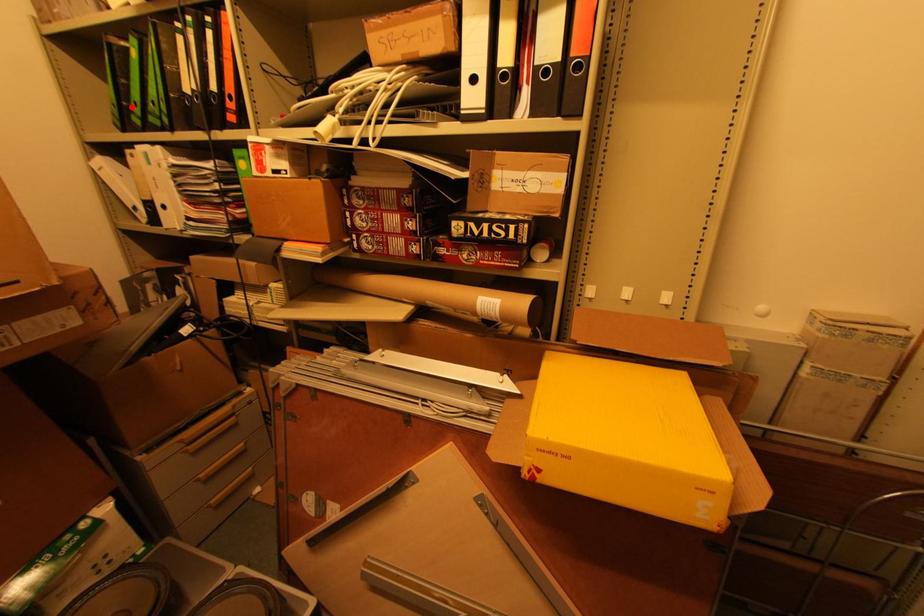
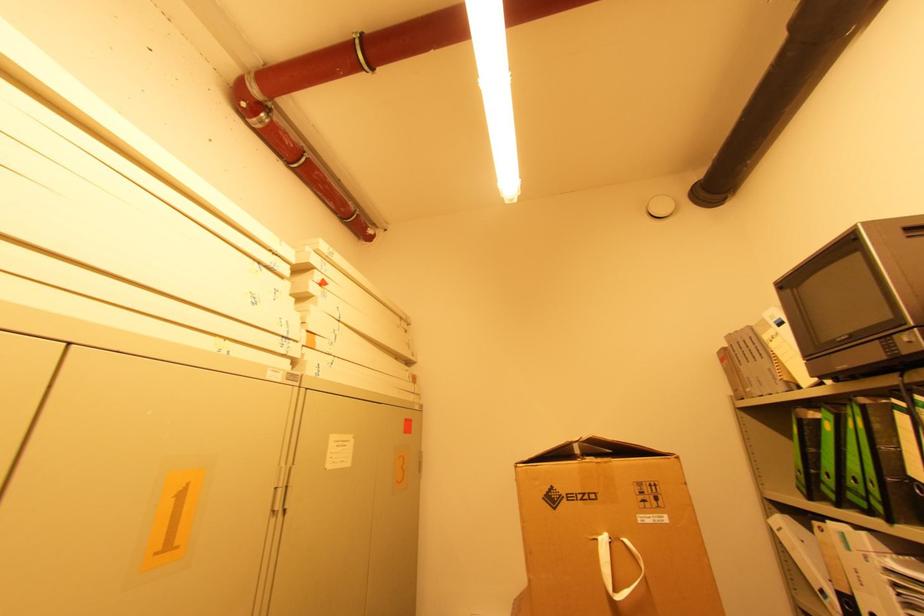
Question: I am providing you with two images of the same scene from different viewpoints. A red point is marked on the first image. Can you still see the location of the red point in image 2?

Choices:
 (A) Yes
 (B) No

Answer: (A)